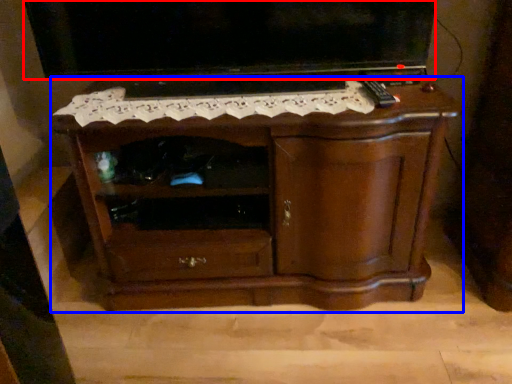
Question: Which of the following is the farthest to the observer, television (highlighted by a red box) or chest of drawers (highlighted by a blue box)?

Choices:
 (A) television
 (B) chest of drawers

Answer: (A)